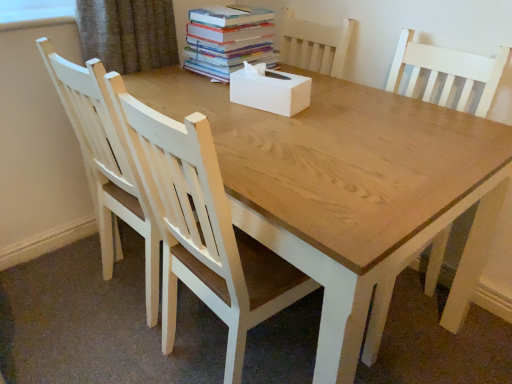
The image size is (512, 384). Find the location of `vacant space that is to the left of white matte tissue box at center`. vacant space that is to the left of white matte tissue box at center is located at coordinates (209, 97).